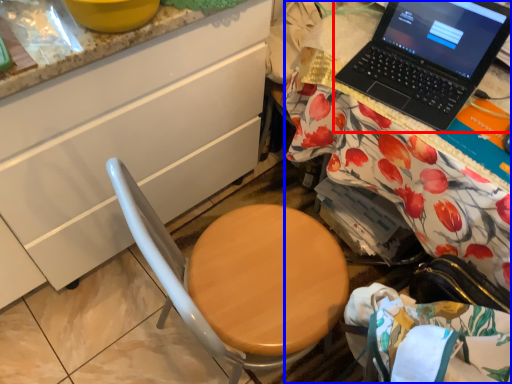
Question: Which object is closer to the camera taking this photo, laptop (highlighted by a red box) or desk (highlighted by a blue box)?

Choices:
 (A) laptop
 (B) desk

Answer: (B)